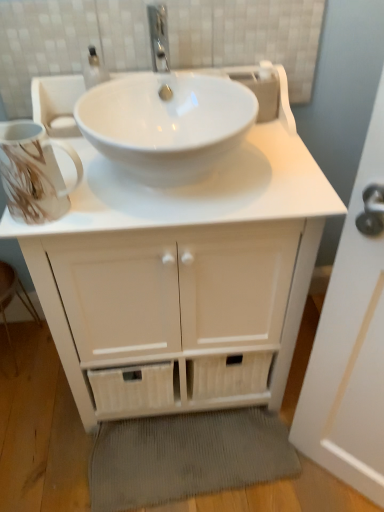
Question: In the image, is gray corduroy bath mat at lower center on the left side or the right side of white matte cabinet at center?

Choices:
 (A) right
 (B) left

Answer: (A)

Question: Is gray corduroy bath mat at lower center in front of or behind white matte cabinet at center in the image?

Choices:
 (A) front
 (B) behind

Answer: (B)

Question: Estimate the real-world distances between objects in this image. Which object is closer to the wooden step stool at lower left?

Choices:
 (A) white matte cabinet at center
 (B) gray corduroy bath mat at lower center

Answer: (B)

Question: Which object is the closest to the gray corduroy bath mat at lower center?

Choices:
 (A) white matte cabinet at center
 (B) wooden step stool at lower left

Answer: (A)